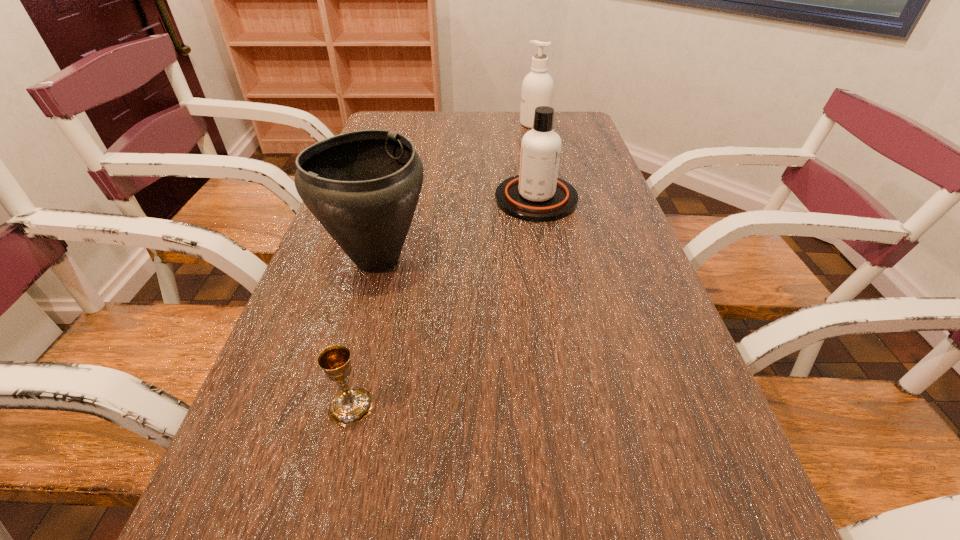
This screenshot has width=960, height=540. Identify the location of vacant area between the shortest object and the farther cleansing agent. (443, 265).

I want to click on empty location between the third nearest object and the chalice, so click(x=444, y=302).

Identify the location of vacant area that lies between the farthest object and the urn. (456, 192).

You are a GUI agent. You are given a task and a screenshot of the screen. Output one action in this format:
    pyautogui.click(x=<x>, y=<y>)
    Task: Click on the free point between the third nearest object and the urn
    The width and height of the screenshot is (960, 540).
    Given the screenshot: What is the action you would take?
    pyautogui.click(x=457, y=229)

At what (x,y) coordinates should I click in order to perform the action: click on free space between the urn and the second farthest object. Please return your answer as a coordinate pair (x, y). The image size is (960, 540). Looking at the image, I should click on (457, 229).

Locate which object is the closest to the shortest object. Please provide its 2D coordinates. Your answer should be formatted as a tuple, i.e. [(x, y)], where the tuple contains the x and y coordinates of a point satisfying the conditions above.

[(363, 187)]

The height and width of the screenshot is (540, 960). Find the location of `object that is the third closest one to the third nearest object`. object that is the third closest one to the third nearest object is located at coordinates (350, 406).